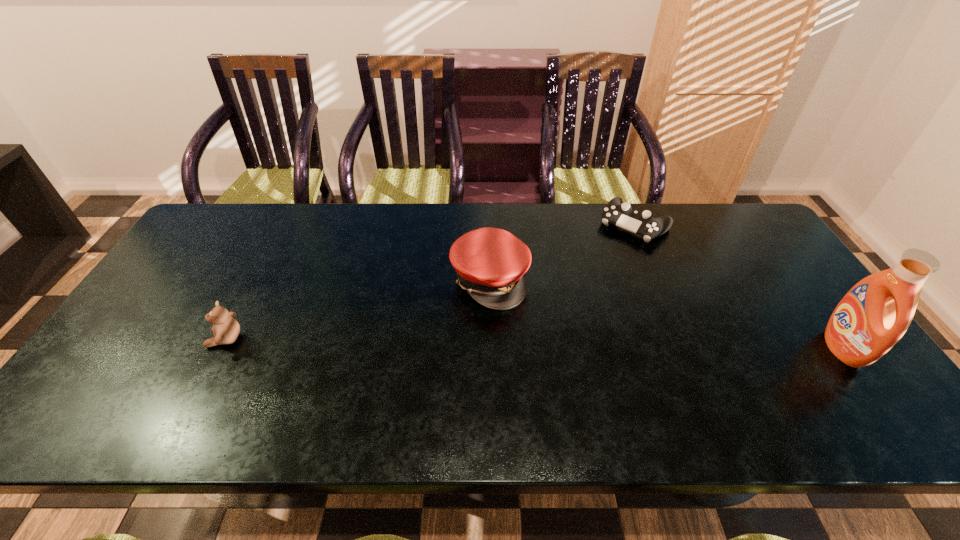
Find the location of `vacant area that satisfies the following two spatial constraints: 1. on the front side of the third object from right to left; 2. on the front-facing side of the rightmost object`. vacant area that satisfies the following two spatial constraints: 1. on the front side of the third object from right to left; 2. on the front-facing side of the rightmost object is located at coordinates (492, 348).